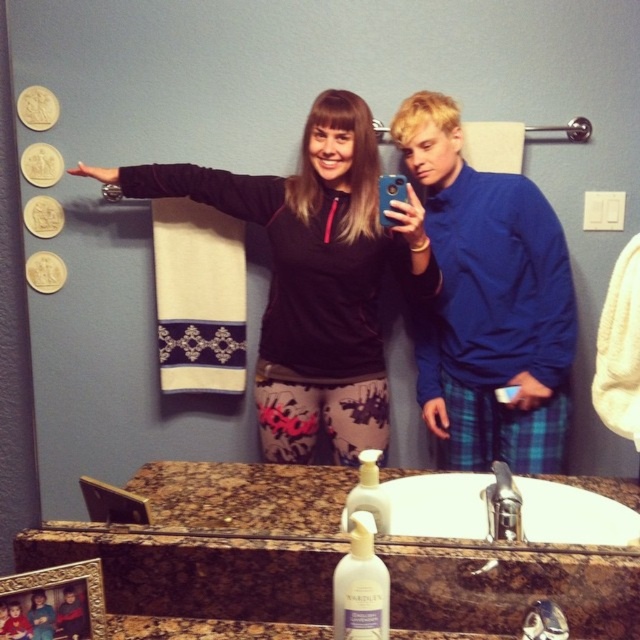
You are standing in the bathroom and want to reach the blue sweater at center to grab your keys. Can you estimate if you can reach it without moving any furniture?

The blue sweater at center is 5.69 feet away from the viewer, so unless you have an exceptionally long reach, it might be difficult to grab the keys without moving closer or using a tool.

You are taking a selfie in the bathroom and notice two points marked in the scene. The first point is at coordinate point (428,134) and the second is at point (624,515). Which point is closer to the camera?

Point (428,134) is closer to the camera than point (624,515).

From the picture: You are trying to take a selfie in the bathroom mirror. You see the black fleece sweatshirt at center and the blue sweater at center. Which one is closer to the camera?

The black fleece sweatshirt at center is closer to the camera because it is in front of the blue sweater at center.